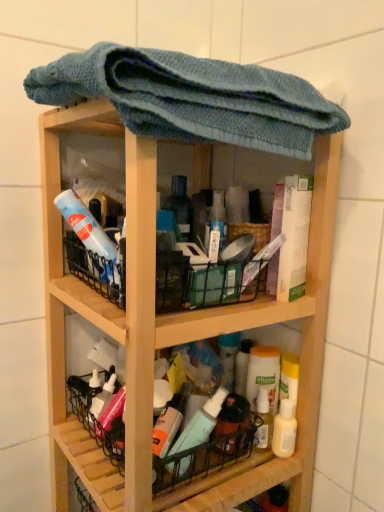
Question: Is wooden shelf at center not near translucent plastic mouthwash at lower right?

Choices:
 (A) yes
 (B) no

Answer: (B)

Question: From a real-world perspective, is wooden shelf at center on translucent plastic mouthwash at lower right?

Choices:
 (A) no
 (B) yes

Answer: (B)

Question: From a real-world perspective, is wooden shelf at center physically below translucent plastic mouthwash at lower right?

Choices:
 (A) yes
 (B) no

Answer: (B)

Question: Is wooden shelf at center facing away from translucent plastic mouthwash at lower right?

Choices:
 (A) yes
 (B) no

Answer: (A)

Question: Can you confirm if wooden shelf at center is positioned to the left of translucent plastic mouthwash at lower right?

Choices:
 (A) no
 (B) yes

Answer: (B)

Question: Is blue knitted towel at upper center wider or thinner than wooden shelf at center?

Choices:
 (A) thin
 (B) wide

Answer: (B)

Question: Is blue knitted towel at upper center bigger or smaller than wooden shelf at center?

Choices:
 (A) small
 (B) big

Answer: (A)

Question: In terms of height, does blue knitted towel at upper center look taller or shorter compared to wooden shelf at center?

Choices:
 (A) tall
 (B) short

Answer: (B)

Question: Is blue knitted towel at upper center in front of or behind wooden shelf at center in the image?

Choices:
 (A) behind
 (B) front

Answer: (B)

Question: In terms of size, does wooden shelf at center appear bigger or smaller than translucent plastic mouthwash at lower right?

Choices:
 (A) big
 (B) small

Answer: (A)

Question: From their relative heights in the image, would you say wooden shelf at center is taller or shorter than translucent plastic mouthwash at lower right?

Choices:
 (A) short
 (B) tall

Answer: (B)

Question: Is wooden shelf at center situated inside translucent plastic mouthwash at lower right or outside?

Choices:
 (A) outside
 (B) inside

Answer: (A)

Question: From a real-world perspective, is wooden shelf at center physically located above or below translucent plastic mouthwash at lower right?

Choices:
 (A) below
 (B) above

Answer: (B)

Question: Is translucent plastic mouthwash at lower right to the left or to the right of wooden shelf at center in the image?

Choices:
 (A) right
 (B) left

Answer: (A)

Question: Is translucent plastic mouthwash at lower right wider or thinner than wooden shelf at center?

Choices:
 (A) wide
 (B) thin

Answer: (B)